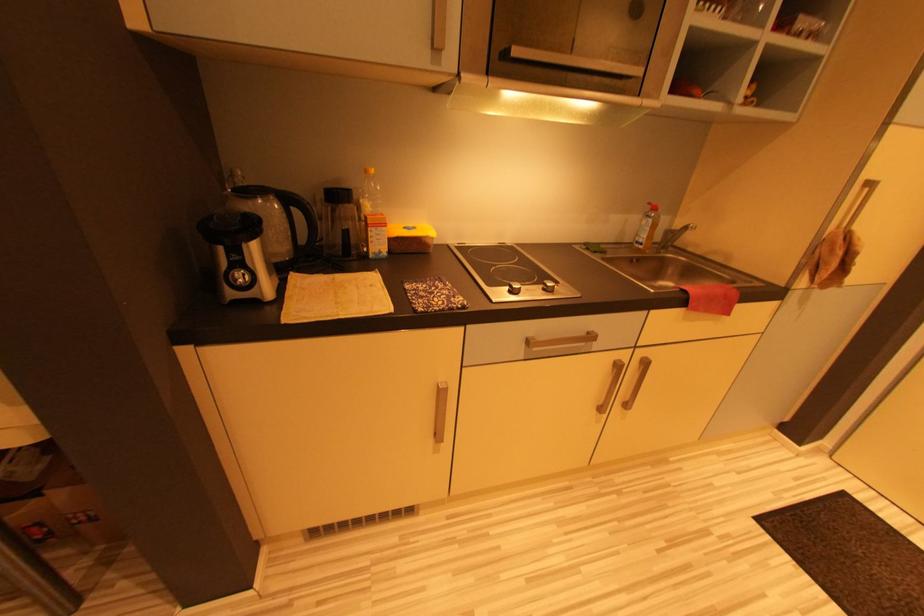
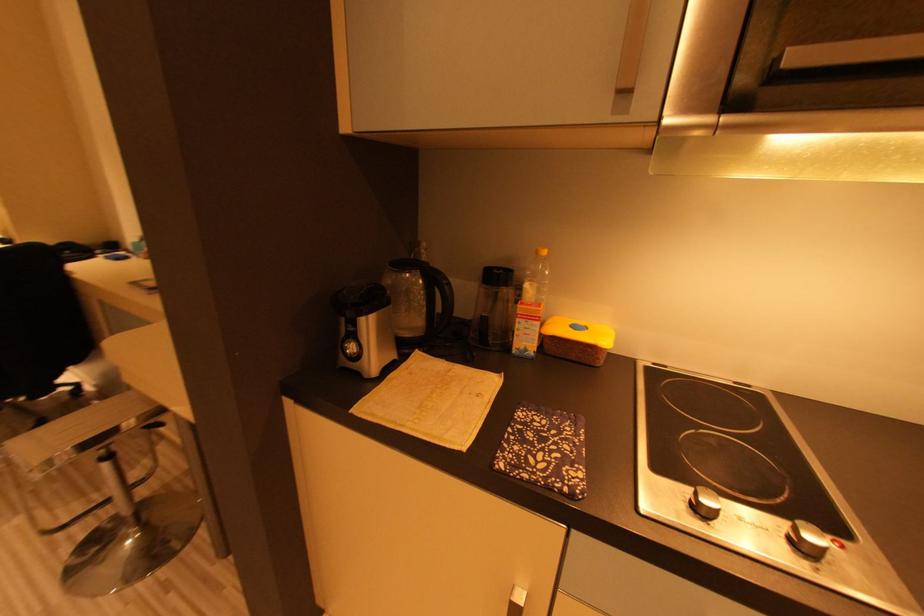
Question: The camera is either moving clockwise (left) or counter-clockwise (right) around the object. The first image is from the beginning of the video and the second image is from the end. Is the camera moving left or right when shooting the video?

Choices:
 (A) Left
 (B) Right

Answer: (B)